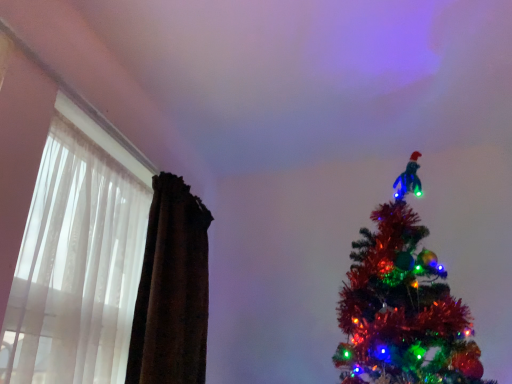
Question: Is brown velvet curtain at left touching translucent fabric at left?

Choices:
 (A) yes
 (B) no

Answer: (B)

Question: Is brown velvet curtain at left at the left side of translucent fabric at left?

Choices:
 (A) yes
 (B) no

Answer: (B)

Question: Is brown velvet curtain at left taller than translucent fabric at left?

Choices:
 (A) yes
 (B) no

Answer: (A)

Question: Could you tell me if brown velvet curtain at left is facing translucent fabric at left?

Choices:
 (A) yes
 (B) no

Answer: (B)

Question: From a real-world perspective, is brown velvet curtain at left located higher than translucent fabric at left?

Choices:
 (A) yes
 (B) no

Answer: (A)

Question: Does brown velvet curtain at left have a lesser height compared to translucent fabric at left?

Choices:
 (A) no
 (B) yes

Answer: (A)

Question: From the image's perspective, does translucent fabric at left appear higher than brown velvet curtain at left?

Choices:
 (A) no
 (B) yes

Answer: (B)

Question: Is translucent fabric at left beside brown velvet curtain at left?

Choices:
 (A) yes
 (B) no

Answer: (B)

Question: From a real-world perspective, is translucent fabric at left below brown velvet curtain at left?

Choices:
 (A) no
 (B) yes

Answer: (B)

Question: Considering the relative sizes of translucent fabric at left and brown velvet curtain at left in the image provided, is translucent fabric at left bigger than brown velvet curtain at left?

Choices:
 (A) yes
 (B) no

Answer: (B)

Question: Considering the relative sizes of translucent fabric at left and brown velvet curtain at left in the image provided, is translucent fabric at left taller than brown velvet curtain at left?

Choices:
 (A) yes
 (B) no

Answer: (B)

Question: From the image's perspective, is translucent fabric at left beneath brown velvet curtain at left?

Choices:
 (A) no
 (B) yes

Answer: (A)

Question: In the image, is brown velvet curtain at left positioned in front of or behind translucent fabric at left?

Choices:
 (A) front
 (B) behind

Answer: (B)